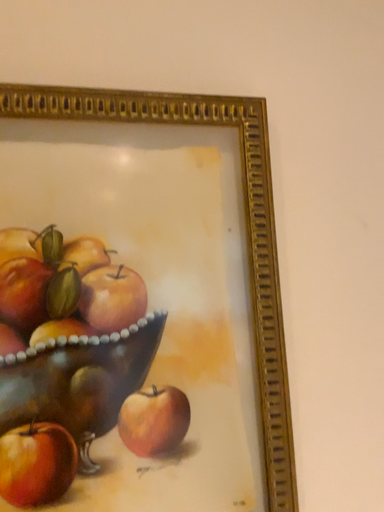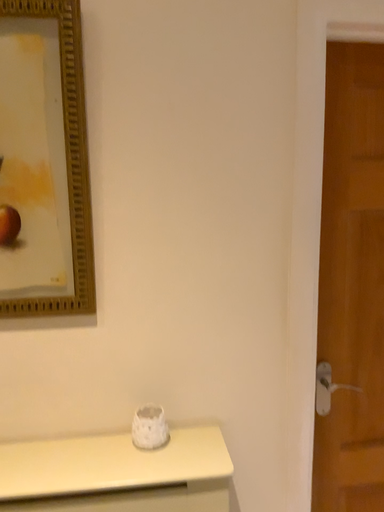
Question: Which way did the camera rotate in the video?

Choices:
 (A) rotated downward
 (B) rotated upward

Answer: (A)